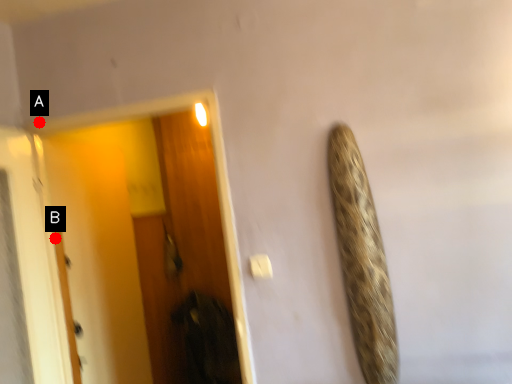
Question: Two points are circled on the image, labeled by A and B beside each circle. Among these points, which one is nearest to the camera?

Choices:
 (A) A is closer
 (B) B is closer

Answer: (A)